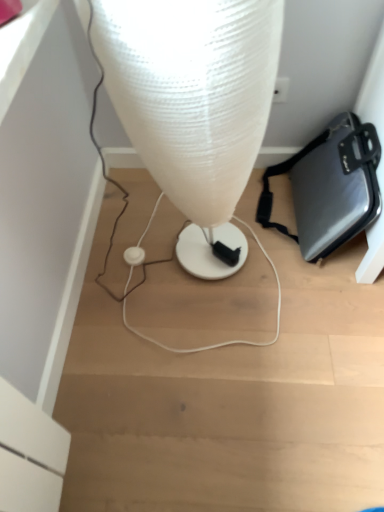
Find the location of a particular element. free location to the right of translucent plastic lamp at center is located at coordinates (287, 289).